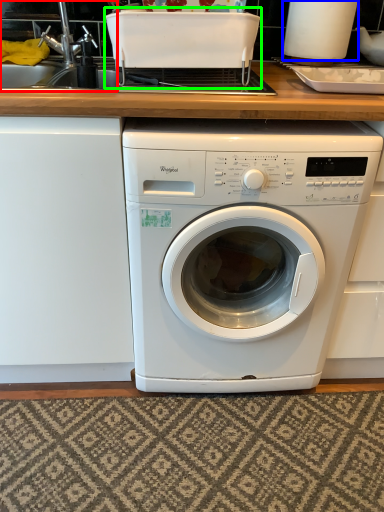
Question: Estimate the real-world distances between objects in this image. Which object is farther from sink (highlighted by a red box), appliance (highlighted by a blue box) or appliance (highlighted by a green box)?

Choices:
 (A) appliance
 (B) appliance

Answer: (A)